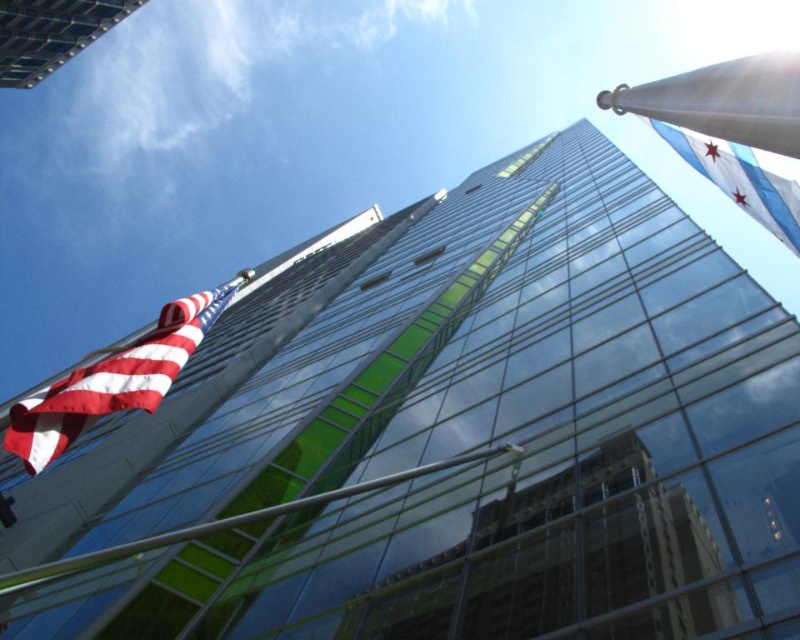
Question: Which of the following is the farthest from the observer?

Choices:
 (A) (772, 60)
 (B) (732, 154)

Answer: (B)

Question: Estimate the real-world distances between objects in this image. Which object is farther from the red-white-striped fabric flag at left?

Choices:
 (A) blue and white striped flag at upper right
 (B) white metallic flagpole at upper right

Answer: (A)

Question: Which point is closer to the camera taking this photo?

Choices:
 (A) (672, 125)
 (B) (193, 300)

Answer: (A)

Question: Can you confirm if white metallic flagpole at upper right is positioned below blue and white striped flag at upper right?

Choices:
 (A) no
 (B) yes

Answer: (A)

Question: In this image, where is red-white-striped fabric flag at left located relative to blue and white striped flag at upper right?

Choices:
 (A) right
 (B) left

Answer: (B)

Question: In this image, where is red-white-striped fabric flag at left located relative to white metallic flagpole at upper right?

Choices:
 (A) right
 (B) left

Answer: (B)